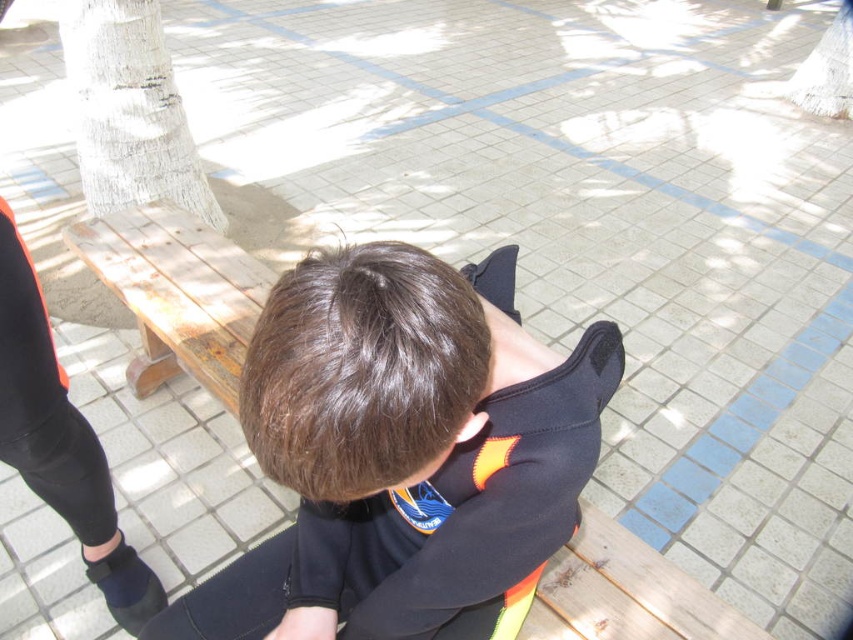
In the scene shown: You are standing in an outdoor area with a wooden bench and a jacket. You want to place a small bag between the black matte jacket at center and the rusty wood bench at left. According to the scene description, which object should the bag be closer to?

The black matte jacket at center is to the right of the rusty wood bench at left, so the small bag should be placed closer to the rusty wood bench at left to be between them.

You are standing at the point marked by the coordinates point (480,563). You want to toss a small pebble to a friend who is standing 3 feet away from you. Will the pebble reach your friend?

The distance between you and your friend is 36 inches, but the point (480,563) is only 34.27 inches away from the viewer. Therefore, the pebble might not reach your friend who is 3 feet away.

You are a delivery person needing to place a small package between the black matte jacket at center and the rusty wood bench at left. The package requires 2 feet of space. Can you fit it there?

The black matte jacket at center is 3.39 feet from the rusty wood bench at left, so yes, the package can fit between them since the distance is more than enough for the required 2 feet.